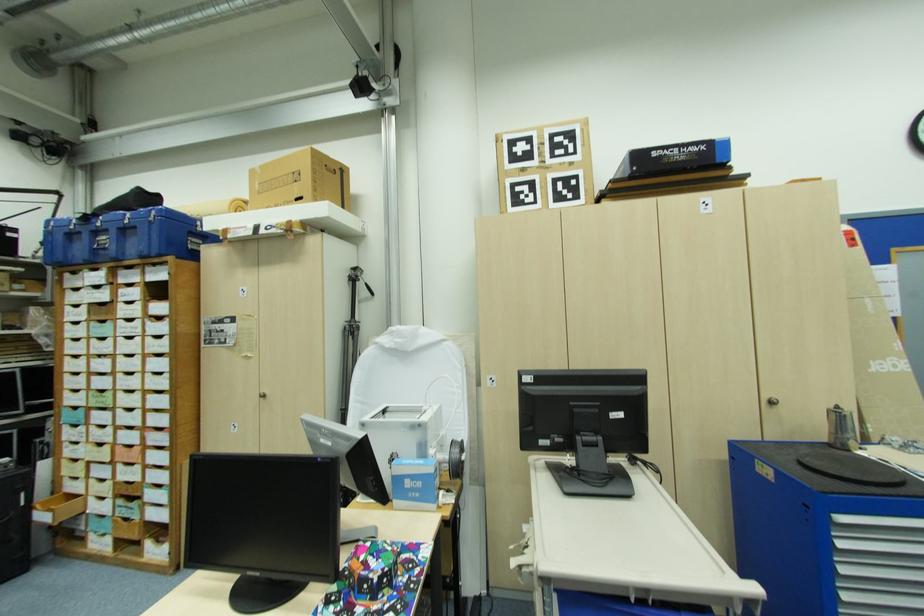
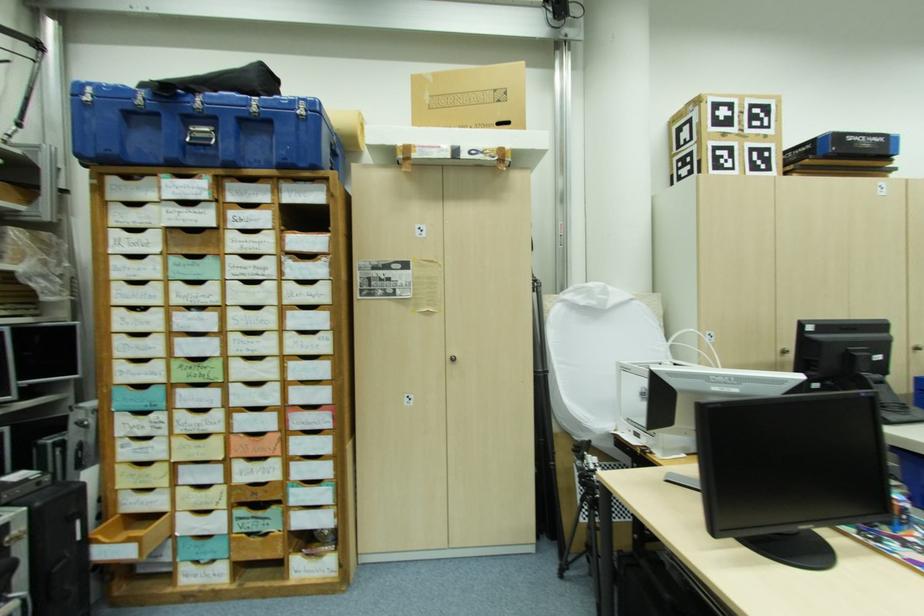
Question: In a continuous first-person perspective shot, in which direction is the camera moving?

Choices:
 (A) Left
 (B) Right
 (C) Forward
 (D) Backward

Answer: (A)